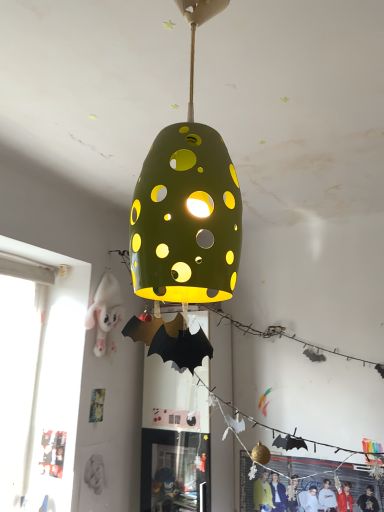
Question: From the image's perspective, is matte black jacket at lower right, arranged as the 1th person when ordered from the bottom, on green matte lampshade at center?

Choices:
 (A) yes
 (B) no

Answer: (B)

Question: Considering the relative sizes of matte black jacket at lower right, arranged as the 1th person when ordered from the bottom, and green matte lampshade at center in the image provided, is matte black jacket at lower right, arranged as the 1th person when ordered from the bottom, shorter than green matte lampshade at center?

Choices:
 (A) no
 (B) yes

Answer: (B)

Question: Can you confirm if matte black jacket at lower right, which is the 2th person from top to bottom, is wider than green matte lampshade at center?

Choices:
 (A) yes
 (B) no

Answer: (B)

Question: Is matte black jacket at lower right, which is the 2th person from top to bottom, in front of green matte lampshade at center?

Choices:
 (A) yes
 (B) no

Answer: (B)

Question: From the image's perspective, is matte black jacket at lower right, which is the 2th person from top to bottom, beneath green matte lampshade at center?

Choices:
 (A) yes
 (B) no

Answer: (A)

Question: Does matte black jacket at lower right, placed as the 1th person when sorted from right to left, have a larger size compared to green matte lampshade at center?

Choices:
 (A) yes
 (B) no

Answer: (B)

Question: Is green matte lampshade at center facing towards matte black jacket at lower right, which is the 2th person from top to bottom?

Choices:
 (A) yes
 (B) no

Answer: (B)

Question: From the image's perspective, is green matte lampshade at center under matte black jacket at lower right, arranged as the 2th person when viewed from the left?

Choices:
 (A) yes
 (B) no

Answer: (B)

Question: Considering the relative sizes of green matte lampshade at center and matte black jacket at lower right, which is the 2th person from top to bottom, in the image provided, is green matte lampshade at center shorter than matte black jacket at lower right, which is the 2th person from top to bottom,?

Choices:
 (A) yes
 (B) no

Answer: (B)

Question: Does green matte lampshade at center have a smaller size compared to matte black jacket at lower right, arranged as the 2th person when viewed from the left?

Choices:
 (A) no
 (B) yes

Answer: (A)

Question: Is green matte lampshade at center far from matte black jacket at lower right, which is the 2th person from top to bottom?

Choices:
 (A) yes
 (B) no

Answer: (A)

Question: Is green matte lampshade at center placed right next to matte black jacket at lower right, which is the 2th person from top to bottom?

Choices:
 (A) yes
 (B) no

Answer: (B)

Question: Does matte black jacket at lower right, arranged as the 1th person when ordered from the bottom, have a larger size compared to white plush toy at left, placed as the 2th person when sorted from bottom to top?

Choices:
 (A) yes
 (B) no

Answer: (B)